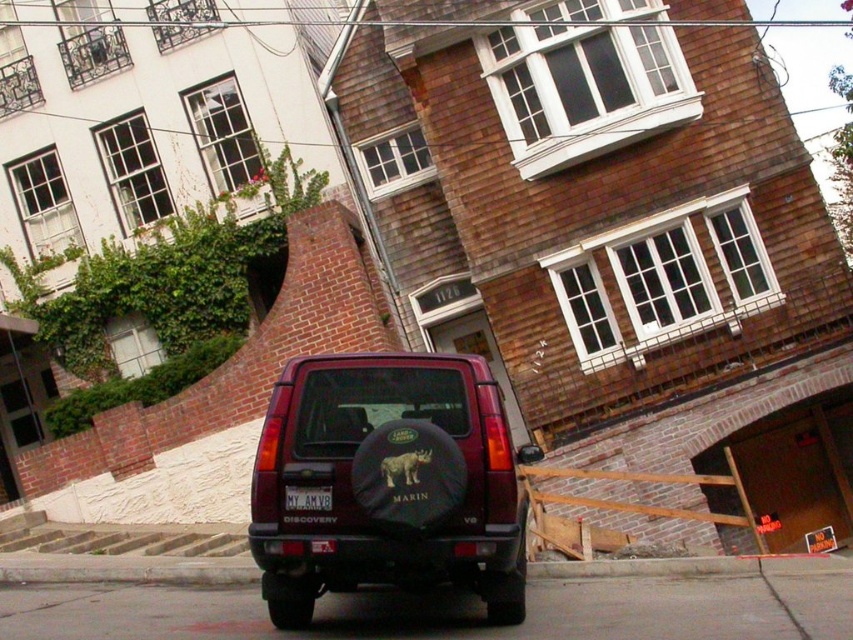
Does maroon matte jeep at center have a greater height compared to black matte license plate at center?

Yes, maroon matte jeep at center is taller than black matte license plate at center.

Does maroon matte jeep at center have a larger size compared to black matte license plate at center?

Yes, maroon matte jeep at center is bigger than black matte license plate at center.

Image resolution: width=853 pixels, height=640 pixels. I want to click on maroon matte jeep at center, so click(389, 483).

Can you confirm if maroon matte jeep at center is thinner than concrete at lower center?

Yes, maroon matte jeep at center is thinner than concrete at lower center.

Between point (451, 480) and point (103, 561), which one is positioned in front?

Point (451, 480)

Which is in front, point (274, 456) or point (39, 556)?

Point (274, 456) is in front.

The image size is (853, 640). I want to click on maroon matte jeep at center, so click(x=389, y=483).

Between point (253, 579) and point (294, 502), which one is positioned behind?

The point (253, 579) is more distant.

Is concrete at lower center wider than black matte license plate at center?

Correct, the width of concrete at lower center exceeds that of black matte license plate at center.

Locate an element on the screen. concrete at lower center is located at coordinates (120, 570).